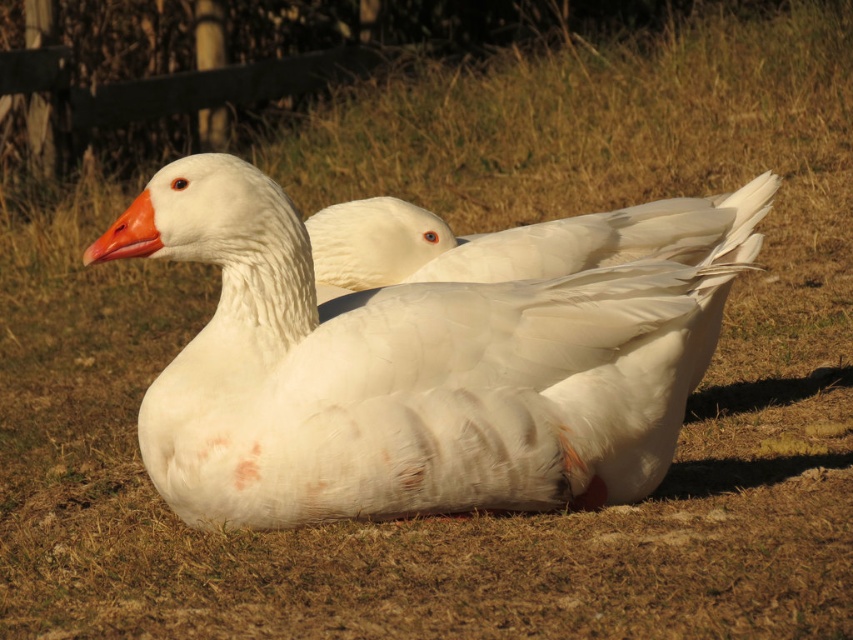
You are a wildlife photographer who wants to capture a closeup shot of both the white feathered duck at center and the white feathered goose at center. Since your camera has a fixed focus area, you need to know which one is wider to ensure proper framing. Which animal should you frame first?

The white feathered duck at center is wider than the white feathered goose at center, so you should frame the white feathered duck at center first to ensure proper focus and framing.

You are a photographer trying to capture a closeup shot of the white feathered duck at center. You have a camera with a zoom lens that can focus on a specific point. The coordinates of the point you need to focus on are given as point (410, 374). Can you confirm if this point corresponds to the white feathered duck at center?

Yes, the point (410, 374) corresponds to the white feathered duck at center, so focusing there will capture the duck clearly.